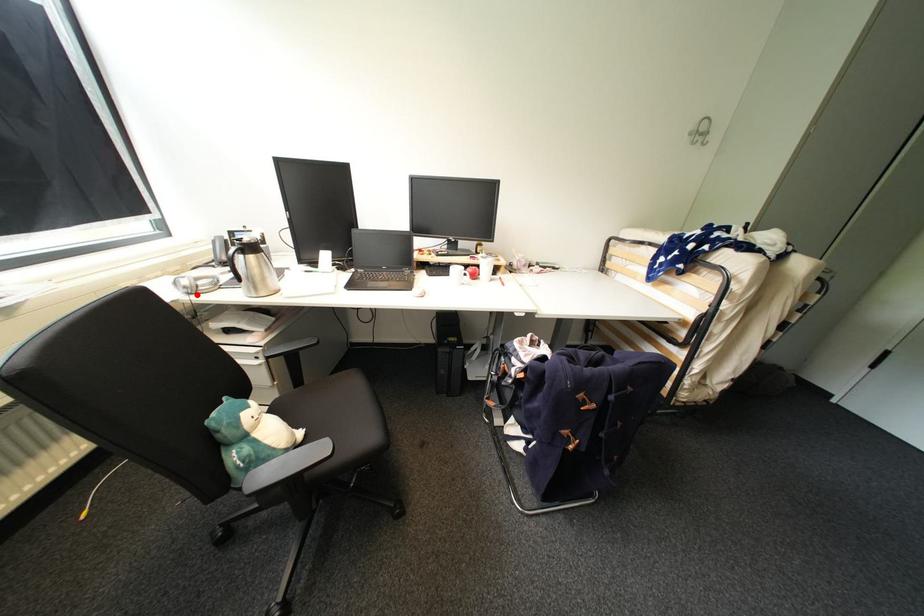
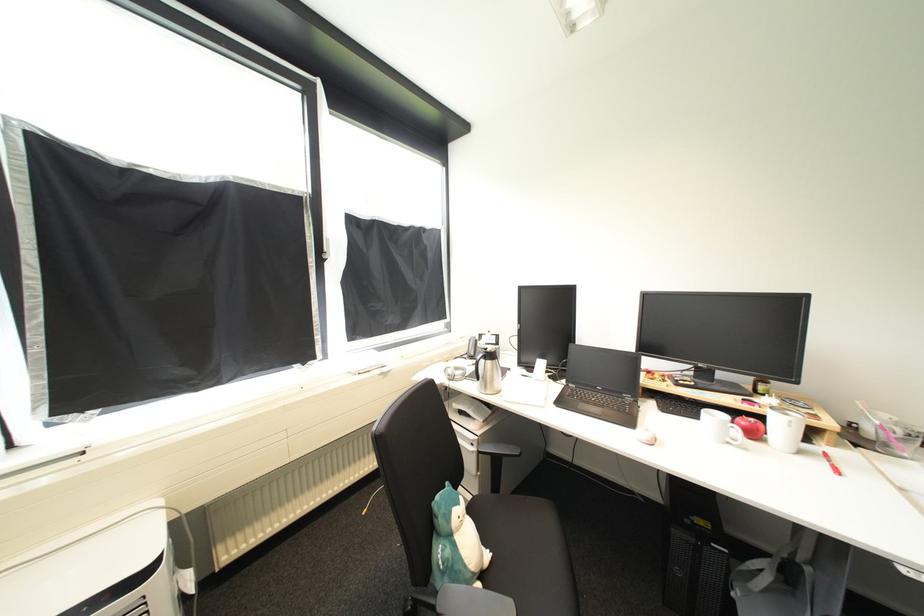
Find the pixel in the second image that matches the highlighted location in the first image.

(456, 381)